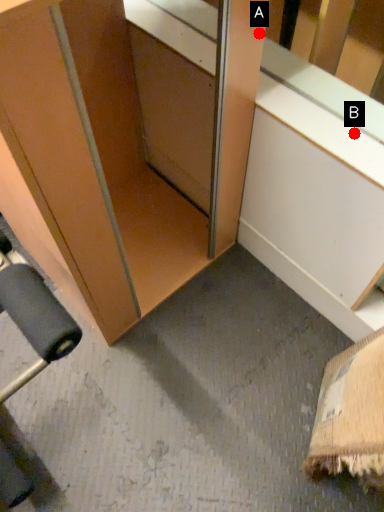
Question: Two points are circled on the image, labeled by A and B beside each circle. Which point appears farthest from the camera in this image?

Choices:
 (A) A is further
 (B) B is further

Answer: (B)